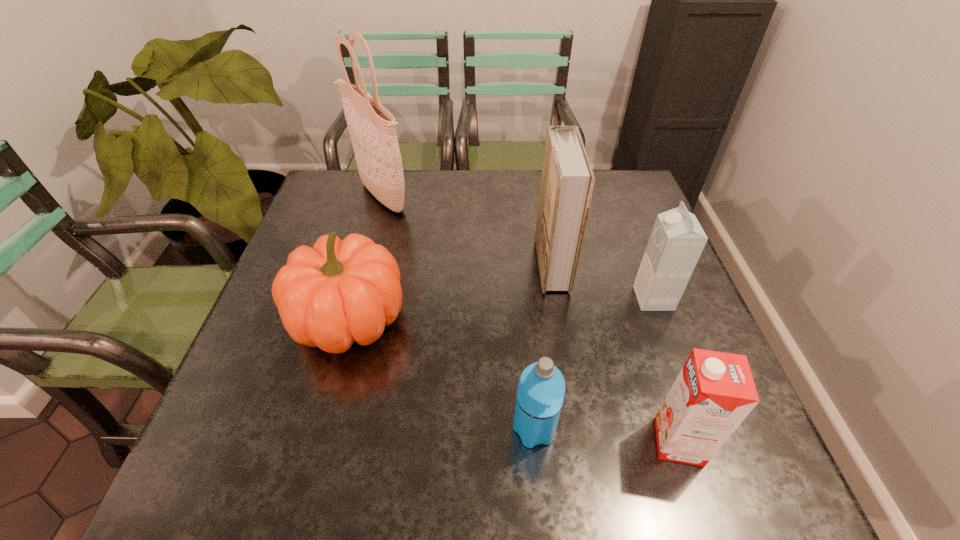
At what (x,y) coordinates should I click in order to perform the action: click on free point located 0.150m on the cover of the phonebook. Please return your answer as a coordinate pair (x, y). This screenshot has width=960, height=540. Looking at the image, I should click on (480, 264).

At what (x,y) coordinates should I click in order to perform the action: click on vacant space located 0.050m on the cover of the phonebook. Please return your answer as a coordinate pair (x, y). The height and width of the screenshot is (540, 960). Looking at the image, I should click on (518, 264).

The height and width of the screenshot is (540, 960). What are the coordinates of `vacant space located 0.210m on the front label of the farther carton` in the screenshot? It's located at (549, 299).

This screenshot has width=960, height=540. What are the coordinates of `vacant space located 0.060m on the front label of the farther carton` in the screenshot? It's located at [612, 299].

Find the location of `free space located 0.240m on the front label of the farther carton`. free space located 0.240m on the front label of the farther carton is located at coordinates (536, 299).

Image resolution: width=960 pixels, height=540 pixels. Identify the location of vacant space situated on the right of the pumpkin. (556, 319).

This screenshot has width=960, height=540. I want to click on vacant space located on the back of the nearer carton, so click(x=655, y=369).

At what (x,y) coordinates should I click in order to perform the action: click on blank area located 0.210m on the right of the third object from left to right. Please return your answer as a coordinate pair (x, y). This screenshot has width=960, height=540. Looking at the image, I should click on (668, 429).

Image resolution: width=960 pixels, height=540 pixels. I want to click on object located at the far edge, so click(371, 126).

The height and width of the screenshot is (540, 960). What are the coordinates of `carton at the near edge` in the screenshot? It's located at (714, 392).